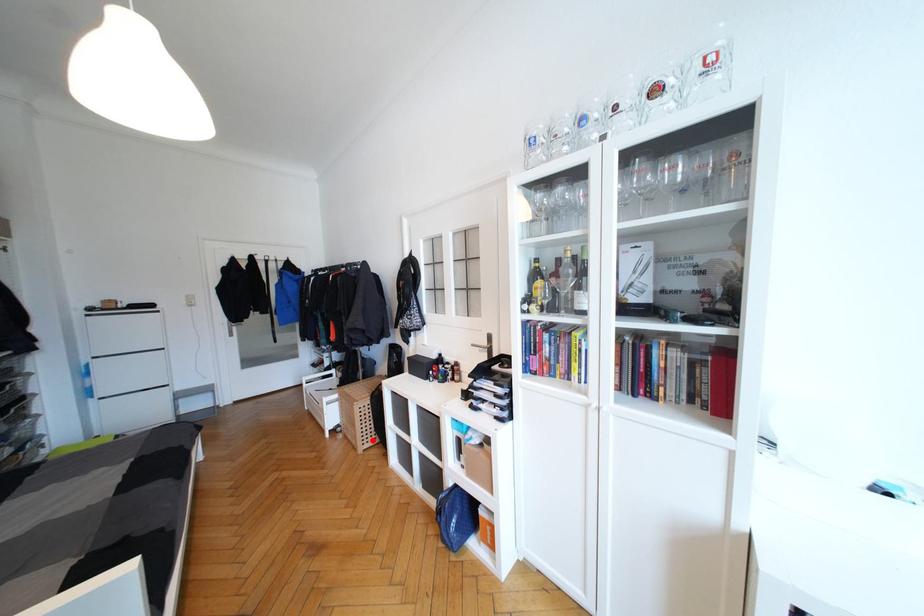
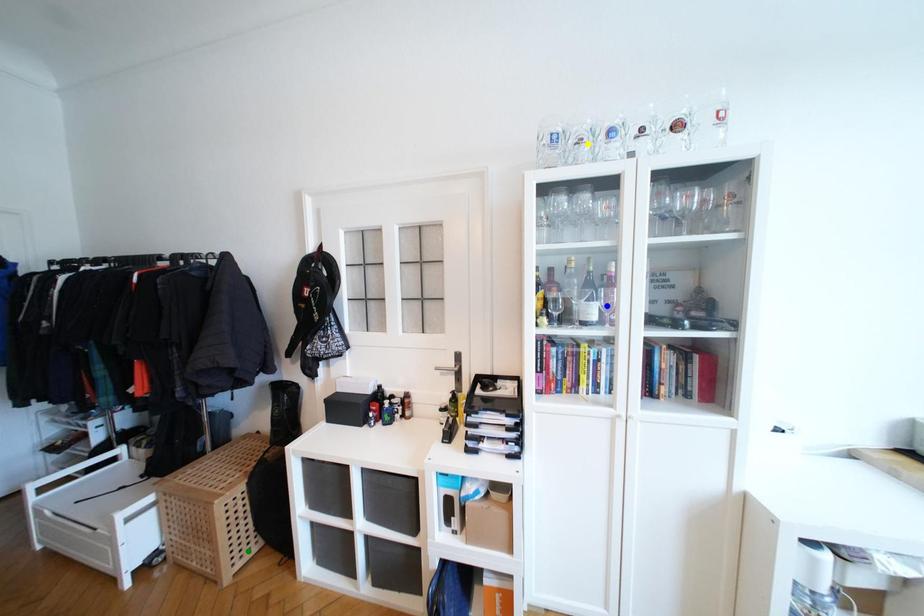
Question: I am providing you with two images of the same scene from different viewpoints. A red point is marked on the first image. You are given multiple points on the second image. Can you choose the point in image 2 that corresponds to the point in image 1?

Choices:
 (A) blue point
 (B) yellow point
 (C) green point

Answer: (C)